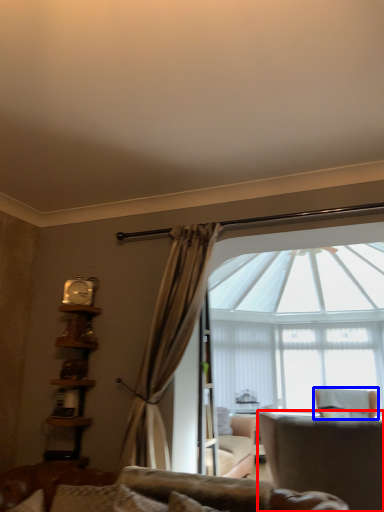
Question: Among these objects, which one is nearest to the camera, chair (highlighted by a red box) or chair (highlighted by a blue box)?

Choices:
 (A) chair
 (B) chair

Answer: (A)